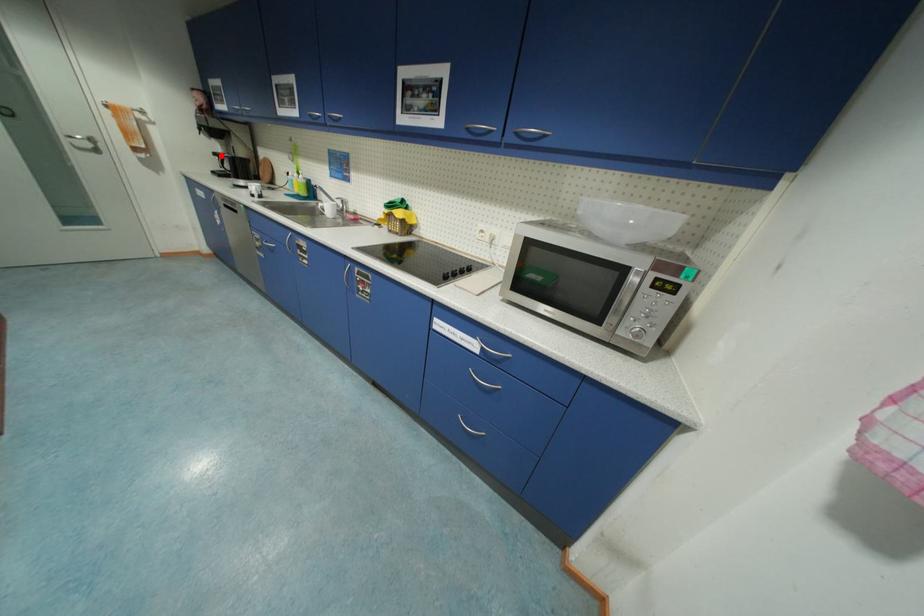
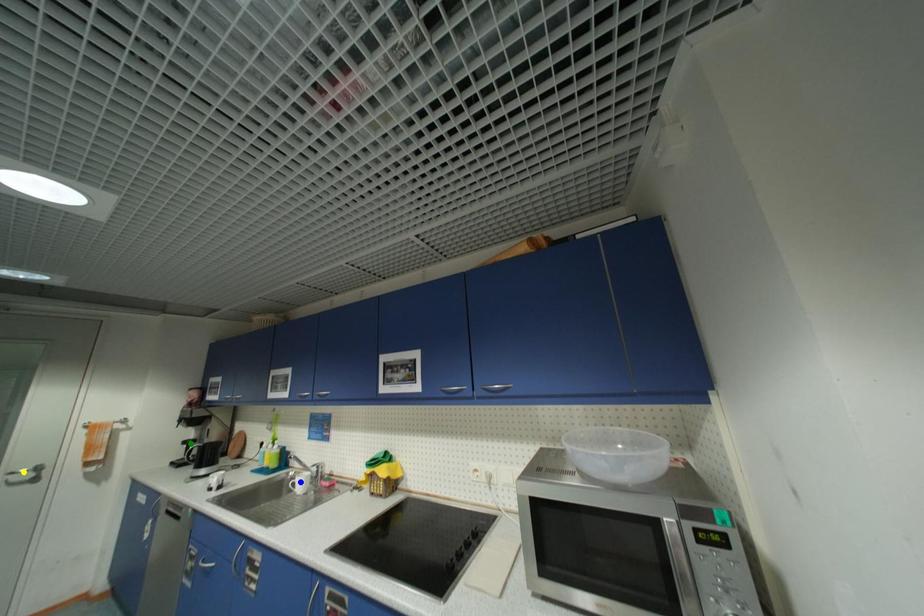
Question: I am providing you with two images of the same scene from different viewpoints. A red point is marked on the first image. You are given multiple points on the second image. Which mark in image 2 goes with the point in image 1?

Choices:
 (A) blue point
 (B) green point
 (C) yellow point

Answer: (B)